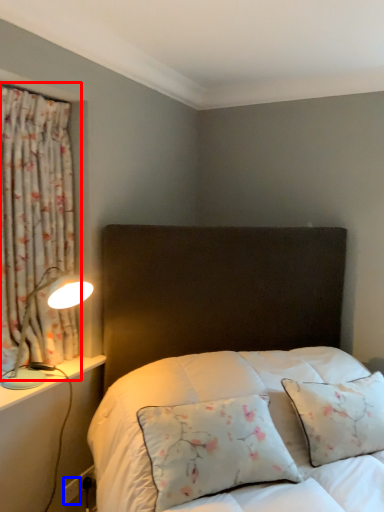
Question: Among these objects, which one is nearest to the camera, curtain (highlighted by a red box) or electric outlet (highlighted by a blue box)?

Choices:
 (A) curtain
 (B) electric outlet

Answer: (A)